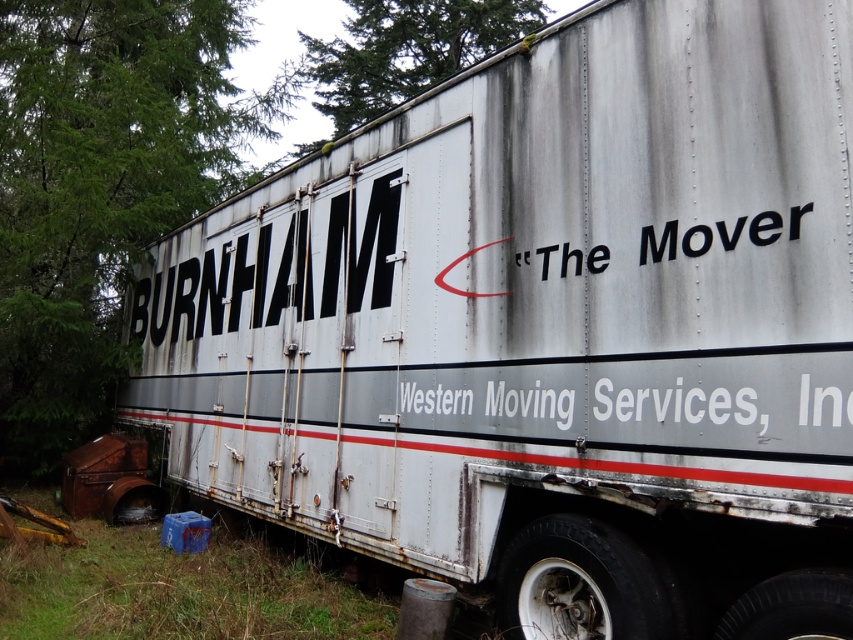
You are a delivery person who needs to identify the trailer for a pickup. You see the green mossy tree at upper center and the white matte text at center. Which one is bigger in size?

The green mossy tree at upper center has a larger size compared to the white matte text at center.

What are the coordinates of the green mossy tree at upper center?

The green mossy tree at upper center is located at coordinates point [405,51].

You are standing in front of the moving trailer and notice two points marked on its side. The first point is at coordinate point (532, 10) and the second is at point (665, 241). Which point is closer to you?

Point (532, 10) is closer to you because it is further to the viewer than point (665, 241).